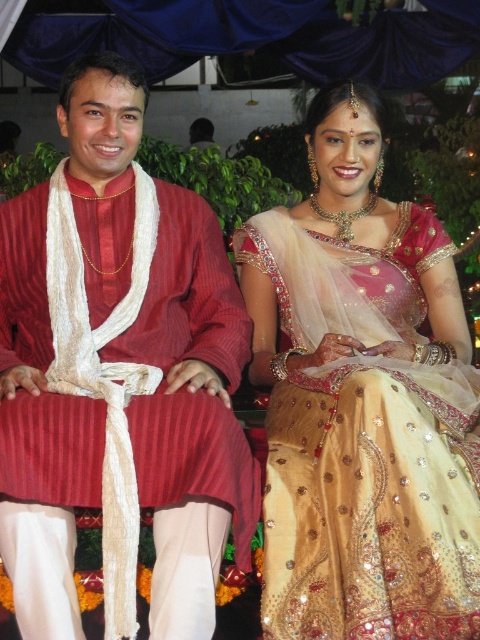
Question: Which of the following is the closest to the observer?

Choices:
 (A) (260, 364)
 (B) (252, 490)

Answer: (B)

Question: Is matte red fabric at center positioned at the back of golden silk saree at center?

Choices:
 (A) no
 (B) yes

Answer: (B)

Question: Among these objects, which one is nearest to the camera?

Choices:
 (A) matte red fabric at center
 (B) golden silk saree at center

Answer: (B)

Question: Is matte red fabric at center closer to the viewer compared to golden silk saree at center?

Choices:
 (A) yes
 (B) no

Answer: (B)

Question: Which point is farther to the camera?

Choices:
 (A) matte red fabric at center
 (B) golden silk saree at center

Answer: (A)

Question: Is matte red fabric at center to the right of golden silk saree at center from the viewer's perspective?

Choices:
 (A) yes
 (B) no

Answer: (B)